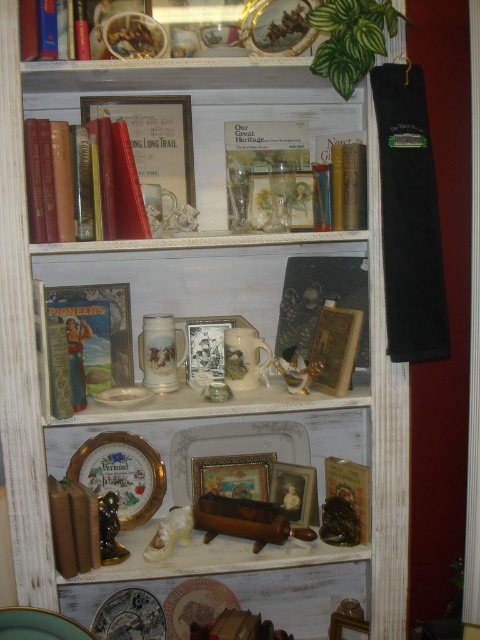
You are arranging dishes on a shelf and notice the matte white plate at lower left and the white glossy plate at center. Which plate is positioned lower on the shelf?

The matte white plate at lower left is positioned lower than the white glossy plate at center.

You are arranging items on a vintage bookshelf and notice the matte white plate at lower left and the matte gold book at center. Which item is located to the left of the other?

The matte white plate at lower left is positioned on the left side of the matte gold book at center.